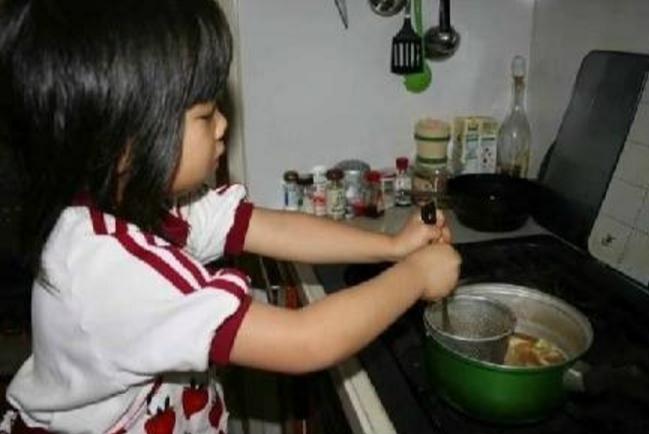
You are a GUI agent. You are given a task and a screenshot of the screen. Output one action in this format:
    pyautogui.click(x=<x>, y=<y>)
    Task: Click on the pot
    The image size is (649, 434).
    Given the screenshot: What is the action you would take?
    pyautogui.click(x=503, y=389)